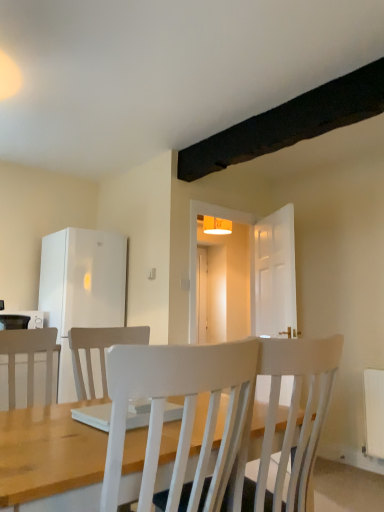
What do you see at coordinates (183, 413) in the screenshot? I see `white textured chair at center` at bounding box center [183, 413].

This screenshot has width=384, height=512. I want to click on white glossy microwave at left, so click(29, 316).

From a real-world perspective, is white textured chair at center above or below white matte refrigerator at left?

In terms of real-world spatial position, white textured chair at center is below white matte refrigerator at left.

Between white textured chair at center and white matte refrigerator at left, which one has smaller size?

With smaller size is white matte refrigerator at left.

Measure the distance between white textured chair at center and white matte refrigerator at left.

2.34 meters.

Who is shorter, white textured chair at center or white matte refrigerator at left?

Standing shorter between the two is white matte refrigerator at left.

Locate an element on the screen. fridge lying on the left of white textured chair at center is located at coordinates (81, 288).

Is point (98, 392) positioned after point (178, 447)?

Yes, point (98, 392) is behind point (178, 447).

From the picture: Considering the sizes of objects white matte refrigerator at left and white textured chair at center in the image provided, who is smaller, white matte refrigerator at left or white textured chair at center?

white matte refrigerator at left is smaller.

Based on the photo, considering their positions, is white matte refrigerator at left located in front of or behind white textured chair at center?

In the image, white matte refrigerator at left appears behind white textured chair at center.

From a real-world perspective, who is located lower, white glossy microwave at left or white textured chair at center?

white textured chair at center.

Considering the sizes of white glossy microwave at left and white textured chair at center in the image, is white glossy microwave at left wider or thinner than white textured chair at center?

white glossy microwave at left is thinner than white textured chair at center.

Between point (32, 311) and point (211, 485), which one is positioned behind?

The point (32, 311) is farther.

From the image's perspective, would you say white glossy microwave at left is positioned over white textured chair at center?

Yes, from the image's perspective, white glossy microwave at left is over white textured chair at center.

Considering the relative sizes of white matte refrigerator at left and white glossy microwave at left in the image provided, is white matte refrigerator at left smaller than white glossy microwave at left?

No, white matte refrigerator at left is not smaller than white glossy microwave at left.

Between white matte refrigerator at left and white glossy microwave at left, which one appears on the right side from the viewer's perspective?

From the viewer's perspective, white matte refrigerator at left appears more on the right side.

Is white matte refrigerator at left inside or outside of white glossy microwave at left?

white matte refrigerator at left is located beyond the bounds of white glossy microwave at left.

Is white textured chair at center located outside white glossy microwave at left?

Yes, white textured chair at center is outside of white glossy microwave at left.

From the picture: Which point is more forward, (180, 449) or (32, 314)?

The point (180, 449) is more forward.

From the image's perspective, is white textured chair at center on white glossy microwave at left?

Actually, white textured chair at center appears below white glossy microwave at left in the image.

From the image's perspective, would you say white glossy microwave at left is shown under white matte refrigerator at left?

Indeed, from the image's perspective, white glossy microwave at left is shown beneath white matte refrigerator at left.

In the image, is white glossy microwave at left positioned in front of or behind white matte refrigerator at left?

white glossy microwave at left is positioned closer to the viewer than white matte refrigerator at left.

Identify the location of appliance located on the left of white matte refrigerator at left. (29, 316).

You are a GUI agent. You are given a task and a screenshot of the screen. Output one action in this format:
    pyautogui.click(x=<x>, y=<y>)
    Task: Click on the fridge that appears above the white textured chair at center (from a real-world perspective)
    
    Given the screenshot: What is the action you would take?
    pyautogui.click(x=81, y=288)

At what (x,y) coordinates should I click in order to perform the action: click on chair directly beneath the white matte refrigerator at left (from a real-world perspective). Please return your answer as a coordinate pair (x, y). Looking at the image, I should click on (183, 413).

Considering their positions, is white matte refrigerator at left positioned further to white glossy microwave at left than white textured chair at center?

A: white textured chair at center is positioned further to the anchor white glossy microwave at left.

Which object lies further to the anchor point white matte refrigerator at left, white glossy microwave at left or white textured chair at center?

white textured chair at center is positioned further to the anchor white matte refrigerator at left.

Estimate the real-world distances between objects in this image. Which object is further from white textured chair at center, white matte refrigerator at left or white glossy microwave at left?

white glossy microwave at left.

When comparing their distances from white matte refrigerator at left, does white textured chair at center or white glossy microwave at left seem closer?

white glossy microwave at left is closer to white matte refrigerator at left.

Looking at the image, which one is located closer to white textured chair at center, white glossy microwave at left or white matte refrigerator at left?

Based on the image, white matte refrigerator at left appears to be nearer to white textured chair at center.

Estimate the real-world distances between objects in this image. Which object is further from white glossy microwave at left, white textured chair at center or white matte refrigerator at left?

white textured chair at center.

Locate an element on the screen. The height and width of the screenshot is (512, 384). appliance between white textured chair at center and white matte refrigerator at left in the front-back direction is located at coordinates (29, 316).